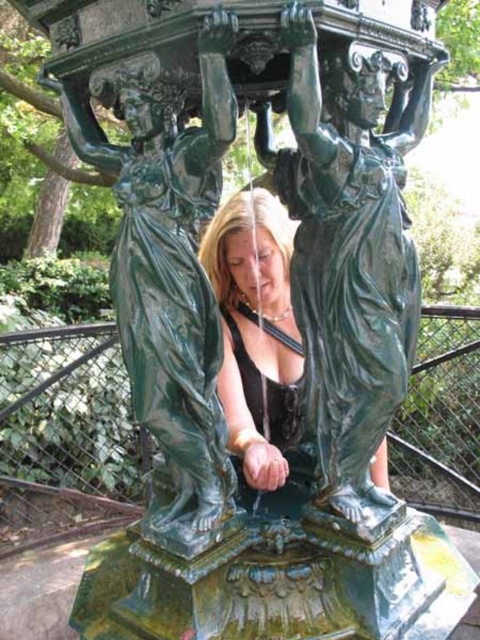
Can you confirm if green polished statue at center is smaller than shiny green statue at center?

No, green polished statue at center is not smaller than shiny green statue at center.

Does point (344, 508) come farther from viewer compared to point (271, 348)?

No, (344, 508) is in front of (271, 348).

Identify the location of green polished statue at center. The width and height of the screenshot is (480, 640). (348, 253).